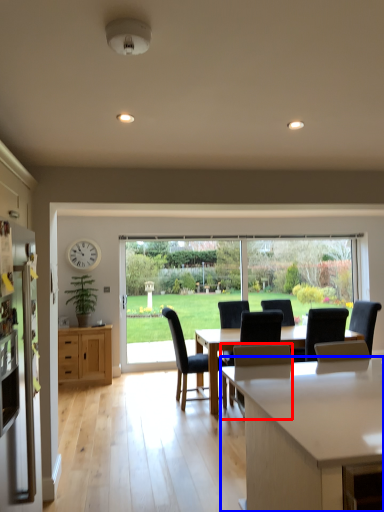
Question: Which object appears closest to the camera in this image, chair (highlighted by a red box) or countertop (highlighted by a blue box)?

Choices:
 (A) chair
 (B) countertop

Answer: (B)